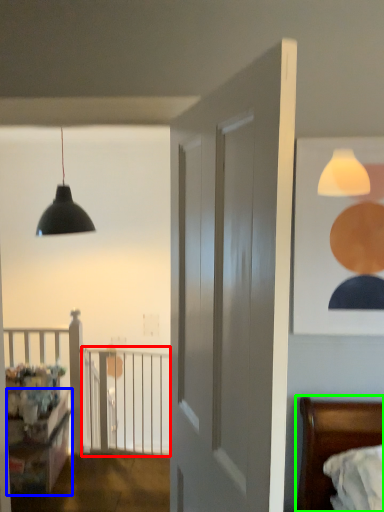
Question: Based on their relative distances, which object is farther from balustrade (highlighted by a red box)? Choose from dresser (highlighted by a blue box) and bed (highlighted by a green box).

Choices:
 (A) dresser
 (B) bed

Answer: (B)